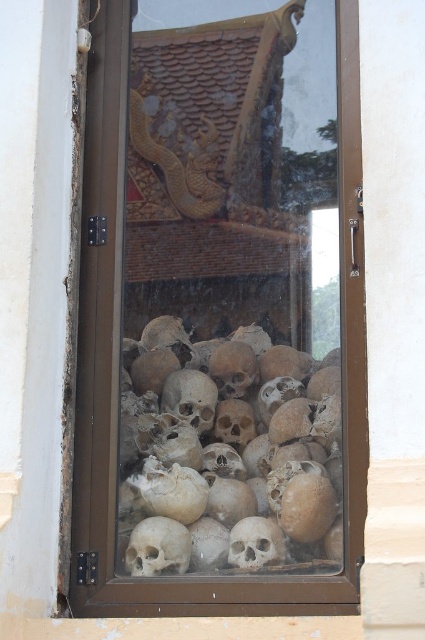
Question: Among these objects, which one is nearest to the camera?

Choices:
 (A) transparent glass skulls at center
 (B) brown textured skull at center

Answer: (A)

Question: In this image, where is transparent glass skulls at center located relative to brown textured skull at center?

Choices:
 (A) right
 (B) left

Answer: (B)

Question: Can you confirm if transparent glass skulls at center is wider than brown textured skull at center?

Choices:
 (A) yes
 (B) no

Answer: (A)

Question: Can you confirm if transparent glass skulls at center is positioned above brown textured skull at center?

Choices:
 (A) yes
 (B) no

Answer: (A)

Question: Which point appears closest to the camera in this image?

Choices:
 (A) (197, 552)
 (B) (305, 40)

Answer: (A)